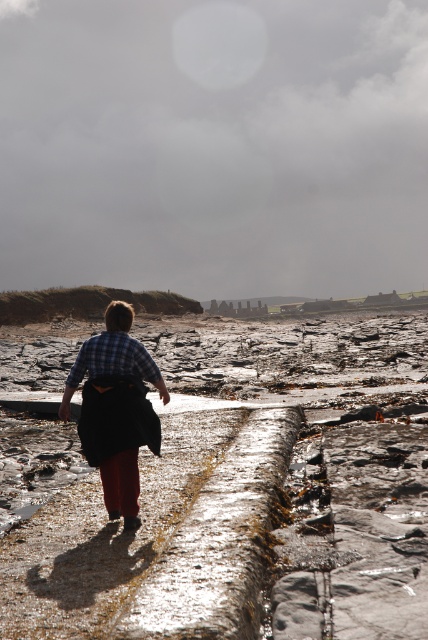
Who is lower down, smooth stone path at center or plaid fabric shirt at center?

smooth stone path at center is lower down.

Image resolution: width=428 pixels, height=640 pixels. What do you see at coordinates (226, 486) in the screenshot?
I see `smooth stone path at center` at bounding box center [226, 486].

Image resolution: width=428 pixels, height=640 pixels. Identify the location of smooth stone path at center. (226, 486).